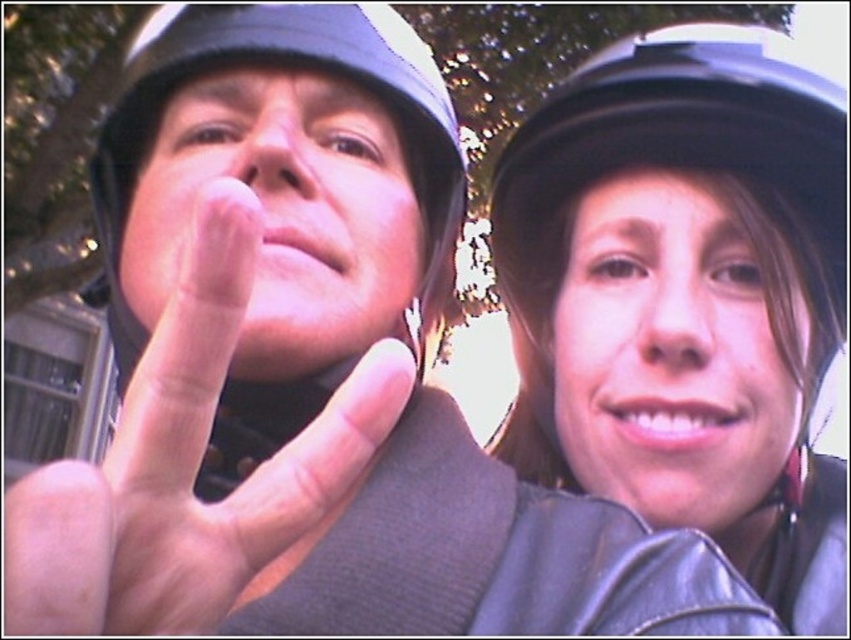
Which is behind, point (218, 369) or point (273, 348)?

The point (273, 348) is more distant.

Is pink flesh-toned hand at center bigger than matte black helmet at center?

Yes.

Locate an element on the screen. The image size is (851, 640). pink flesh-toned hand at center is located at coordinates (186, 465).

Is point (704, 301) farther from viewer compared to point (173, 147)?

Yes, it is.

The height and width of the screenshot is (640, 851). What are the coordinates of `matte black helmet at right` in the screenshot? It's located at (677, 348).

You are a GUI agent. You are given a task and a screenshot of the screen. Output one action in this format:
    pyautogui.click(x=<x>, y=<y>)
    Task: Click on the matte black helmet at right
    The image size is (851, 640).
    Given the screenshot: What is the action you would take?
    pyautogui.click(x=677, y=348)

Is black leather helmet at upper center thinner than matte black helmet at center?

Incorrect, black leather helmet at upper center's width is not less than matte black helmet at center's.

Who is taller, black leather helmet at upper center or matte black helmet at center?

black leather helmet at upper center

Describe the element at coordinates (686, 298) in the screenshot. The height and width of the screenshot is (640, 851). I see `black leather helmet at upper center` at that location.

Where is `black leather helmet at upper center`? This screenshot has height=640, width=851. black leather helmet at upper center is located at coordinates (686, 298).